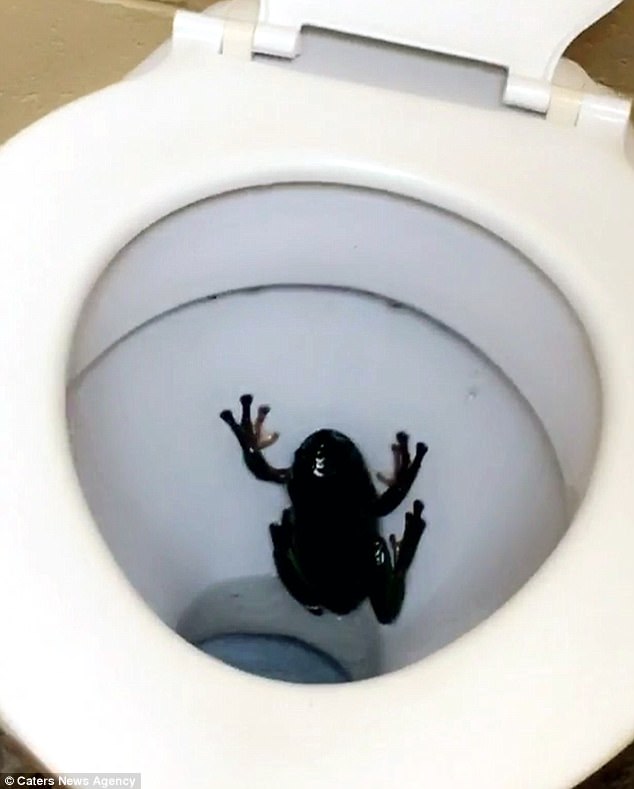
The image size is (634, 789). What are the coordinates of `toilet seat` in the screenshot? It's located at [321, 734].